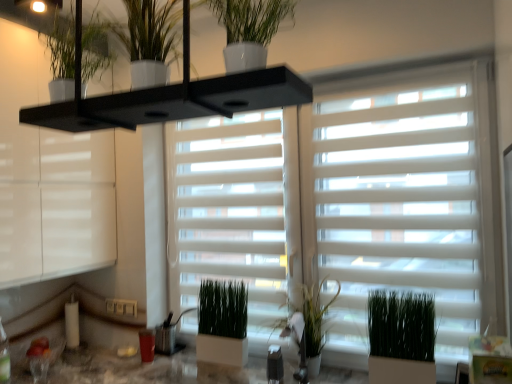
Question: Considering the relative sizes of white glossy window frame at upper left and green matte plant at center, the 1th houseplant ordered from the bottom, in the image provided, is white glossy window frame at upper left thinner than green matte plant at center, the 1th houseplant ordered from the bottom,?

Choices:
 (A) no
 (B) yes

Answer: (A)

Question: From a real-world perspective, is white glossy window frame at upper left positioned under green matte plant at center, which appears as the 5th houseplant when viewed from the front, based on gravity?

Choices:
 (A) no
 (B) yes

Answer: (A)

Question: Considering the relative sizes of white glossy window frame at upper left and green matte plant at center, the 1th houseplant ordered from the bottom, in the image provided, is white glossy window frame at upper left bigger than green matte plant at center, the 1th houseplant ordered from the bottom,?

Choices:
 (A) no
 (B) yes

Answer: (B)

Question: Does white glossy window frame at upper left have a greater height compared to green matte plant at center, which is counted as the 5th houseplant, starting from the top?

Choices:
 (A) yes
 (B) no

Answer: (A)

Question: Considering the relative sizes of white glossy window frame at upper left and green matte plant at center, which appears as the 5th houseplant when viewed from the front, in the image provided, is white glossy window frame at upper left smaller than green matte plant at center, which appears as the 5th houseplant when viewed from the front,?

Choices:
 (A) yes
 (B) no

Answer: (B)

Question: From the image's perspective, is white glossy window frame at upper left beneath green matte plant at center, which appears as the 5th houseplant when viewed from the front?

Choices:
 (A) no
 (B) yes

Answer: (A)

Question: Considering the relative positions of white glossy pot at upper center, which is the 2th houseplant from top to bottom, and white matte window blind at center in the image provided, is white glossy pot at upper center, which is the 2th houseplant from top to bottom, to the right of white matte window blind at center from the viewer's perspective?

Choices:
 (A) yes
 (B) no

Answer: (B)

Question: Is white matte window blind at center completely or partially inside white glossy pot at upper center, the 5th houseplant when ordered from back to front?

Choices:
 (A) no
 (B) yes

Answer: (A)

Question: From a real-world perspective, is white glossy pot at upper center, which is the 2th houseplant from top to bottom, under white matte window blind at center?

Choices:
 (A) no
 (B) yes

Answer: (A)

Question: Is white glossy pot at upper center, the first houseplant positioned from the front, oriented away from white matte window blind at center?

Choices:
 (A) no
 (B) yes

Answer: (B)

Question: Is white glossy pot at upper center, the 4th houseplant from the bottom, closer to the viewer compared to white matte window blind at center?

Choices:
 (A) no
 (B) yes

Answer: (B)

Question: Is white glossy pot at upper center, the 4th houseplant from the bottom, behind white matte window blind at center?

Choices:
 (A) no
 (B) yes

Answer: (A)

Question: Is the depth of green matte plant at upper center, which is the 2th houseplant in front-to-back order, less than that of white glossy window frame at upper left?

Choices:
 (A) yes
 (B) no

Answer: (A)